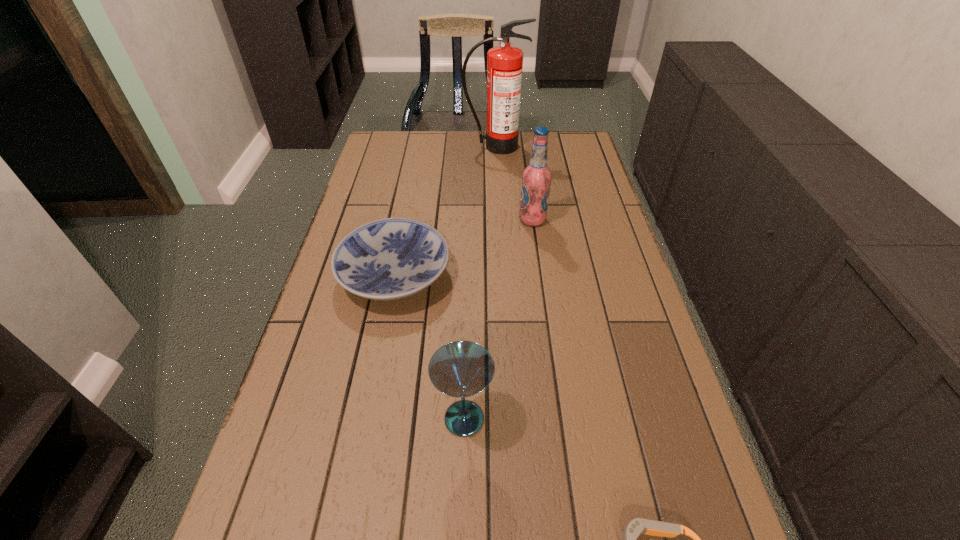
You are a GUI agent. You are given a task and a screenshot of the screen. Output one action in this format:
    pyautogui.click(x=<x>, y=<y>)
    Task: Click on the free space between the plate and the fourth nearest object
    The width and height of the screenshot is (960, 540).
    Given the screenshot: What is the action you would take?
    pyautogui.click(x=464, y=248)

Where is `vacant space in between the farthest object and the alcohol`? vacant space in between the farthest object and the alcohol is located at coordinates (514, 183).

Image resolution: width=960 pixels, height=540 pixels. Find the location of `free spot between the martini and the third nearest object`. free spot between the martini and the third nearest object is located at coordinates (429, 347).

Locate an element on the screen. Image resolution: width=960 pixels, height=540 pixels. the third closest object relative to the farthest object is located at coordinates (459, 369).

This screenshot has height=540, width=960. I want to click on object that is the fourth closest to the third tallest object, so click(x=504, y=63).

You are a GUI agent. You are given a task and a screenshot of the screen. Output one action in this format:
    pyautogui.click(x=<x>, y=<y>)
    Task: Click on the vacant space that satisfies the following two spatial constraints: 1. on the front-facing side of the farthest object; 2. on the right side of the fourth shortest object
    This screenshot has height=540, width=960.
    Given the screenshot: What is the action you would take?
    pyautogui.click(x=498, y=220)

Locate an element on the screen. The height and width of the screenshot is (540, 960). vacant position in the image that satisfies the following two spatial constraints: 1. on the front-facing side of the second farthest object; 2. on the left side of the farthest object is located at coordinates (498, 220).

Find the location of a particular element. This screenshot has height=540, width=960. vacant position in the image that satisfies the following two spatial constraints: 1. on the back side of the fourth shortest object; 2. on the right side of the third shortest object is located at coordinates (469, 220).

Where is `vacant space that satisfies the following two spatial constraints: 1. on the back side of the third shortest object; 2. on the right side of the fourth nearest object`? vacant space that satisfies the following two spatial constraints: 1. on the back side of the third shortest object; 2. on the right side of the fourth nearest object is located at coordinates (469, 220).